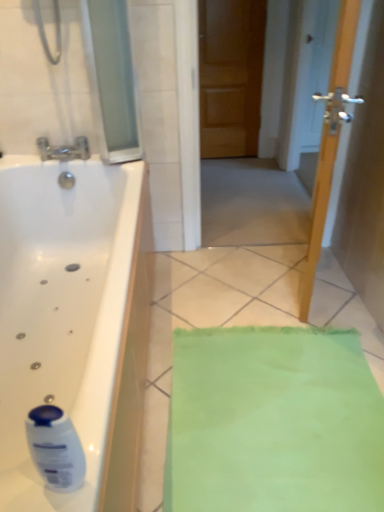
Question: From a real-world perspective, is wooden door at center physically located above or below wooden door at center?

Choices:
 (A) above
 (B) below

Answer: (A)

Question: Do you think wooden door at center is within wooden door at center, or outside of it?

Choices:
 (A) inside
 (B) outside

Answer: (B)

Question: Considering the real-world distances, which object is closest to the white glossy bottle at lower left?

Choices:
 (A) transparent glass door at upper left
 (B) silver metallic faucet at upper left
 (C) wooden door at center
 (D) wooden door at center

Answer: (A)

Question: Estimate the real-world distances between objects in this image. Which object is farther from the wooden door at center?

Choices:
 (A) silver metallic faucet at upper left
 (B) white glossy bottle at lower left
 (C) wooden door at center
 (D) transparent glass door at upper left

Answer: (B)